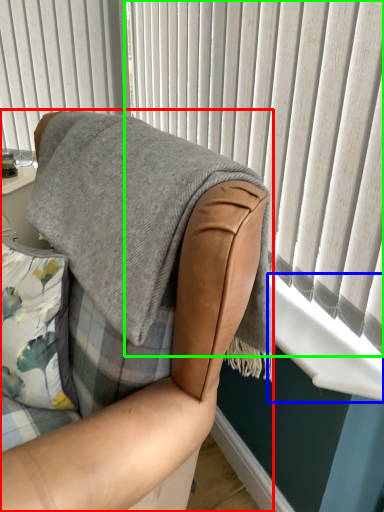
Question: Which object is positioned farthest from chair (highlighted by a red box)? Select from window sill (highlighted by a blue box) and curtain (highlighted by a green box).

Choices:
 (A) window sill
 (B) curtain

Answer: (B)